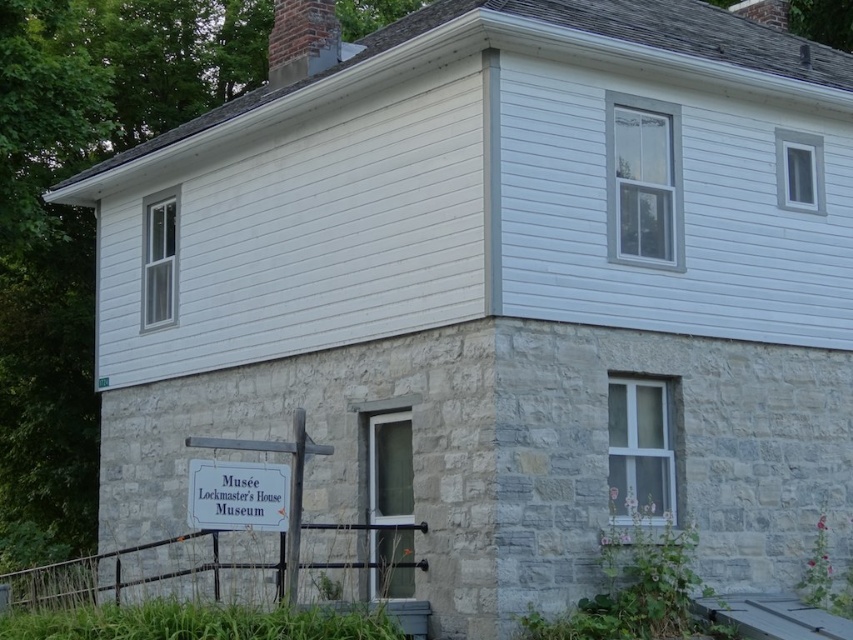
Looking at this image, between white wooden sign at lower center and gray stone chimney at upper center, which one is positioned lower?

white wooden sign at lower center is below.

Describe the element at coordinates (236, 496) in the screenshot. I see `white wooden sign at lower center` at that location.

Locate an element on the screen. white wooden sign at lower center is located at coordinates (236, 496).